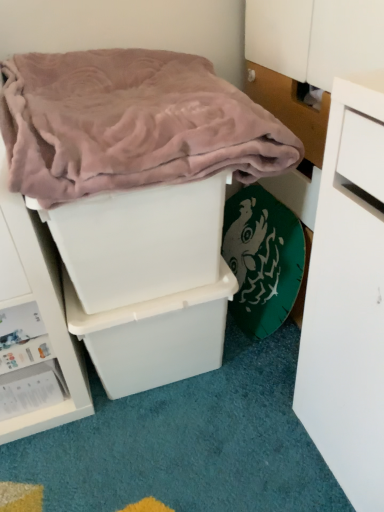
Question: Does white plastic storage box at lower left, acting as the 3th storage box starting from the top, have a larger size compared to pink plush blanket at upper left?

Choices:
 (A) no
 (B) yes

Answer: (A)

Question: Is white plastic storage box at lower left, the first storage box ordered from the bottom, not inside pink plush blanket at upper left?

Choices:
 (A) no
 (B) yes

Answer: (B)

Question: Are white plastic storage box at lower left, the first storage box ordered from the bottom, and pink plush blanket at upper left beside each other?

Choices:
 (A) yes
 (B) no

Answer: (B)

Question: Does white plastic storage box at lower left, acting as the 3th storage box starting from the top, appear on the right side of pink plush blanket at upper left?

Choices:
 (A) yes
 (B) no

Answer: (B)

Question: From the image's perspective, would you say white plastic storage box at lower left, the first storage box ordered from the bottom, is shown under pink plush blanket at upper left?

Choices:
 (A) yes
 (B) no

Answer: (A)

Question: Considering the relative sizes of white plastic storage box at lower left, the first storage box ordered from the bottom, and pink plush blanket at upper left in the image provided, is white plastic storage box at lower left, the first storage box ordered from the bottom, smaller than pink plush blanket at upper left?

Choices:
 (A) yes
 (B) no

Answer: (A)

Question: Does white plastic storage box at center, marked as the 2th storage box in a bottom-to-top arrangement, lie in front of white plastic storage box at center, placed as the 1th storage box when sorted from top to bottom?

Choices:
 (A) yes
 (B) no

Answer: (B)

Question: Is white plastic storage box at center, placed as the 2th storage box when sorted from top to bottom, at the left side of white plastic storage box at center, which ranks as the 3th storage box in bottom-to-top order?

Choices:
 (A) yes
 (B) no

Answer: (B)

Question: From a real-world perspective, does white plastic storage box at center, placed as the 2th storage box when sorted from top to bottom, stand above white plastic storage box at center, which ranks as the 3th storage box in bottom-to-top order?

Choices:
 (A) no
 (B) yes

Answer: (A)

Question: From the image's perspective, is white plastic storage box at center, marked as the 2th storage box in a bottom-to-top arrangement, over white plastic storage box at center, which ranks as the 3th storage box in bottom-to-top order?

Choices:
 (A) yes
 (B) no

Answer: (B)

Question: Is white plastic storage box at center, placed as the 2th storage box when sorted from top to bottom, next to white plastic storage box at center, placed as the 1th storage box when sorted from top to bottom, and touching it?

Choices:
 (A) no
 (B) yes

Answer: (A)

Question: Is white plastic storage box at center, placed as the 2th storage box when sorted from top to bottom, taller than white plastic storage box at center, placed as the 1th storage box when sorted from top to bottom?

Choices:
 (A) no
 (B) yes

Answer: (B)

Question: Does white plastic storage box at center, which ranks as the 3th storage box in bottom-to-top order, have a smaller size compared to white plastic storage box at lower left, acting as the 3th storage box starting from the top?

Choices:
 (A) yes
 (B) no

Answer: (B)